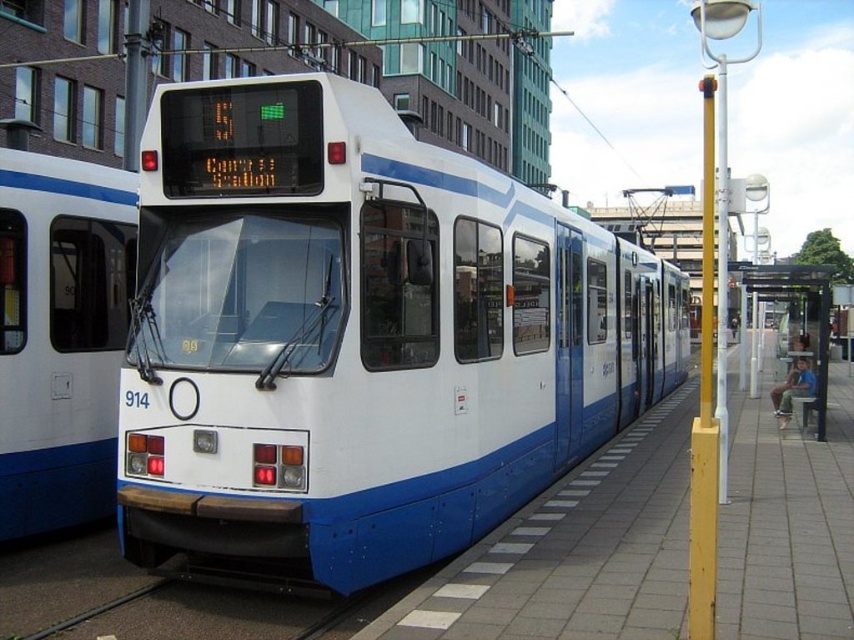
You are a delivery person carrying a large package that is 12 meters long. You need to move from the white glossy train at left to the transparent plastic bus stop at right. Is there enough space for your package to fit between them without bending it?

The distance between the white glossy train at left and transparent plastic bus stop at right is 11.89 meters, which is shorter than the 12 meter length of the package. Therefore, the package cannot fit straight between them without bending.

You are a passenger waiting at the tram station. You see two trams, the white glossy train at center and the white glossy train at left. Which tram is closer to the platform edge?

The white glossy train at left is closer to the platform edge because the white glossy train at center is positioned on the right side of it, meaning the left tram is nearer to the edge while the center tram is further inward.

You are a passenger waiting at the station. You see the white glossy train at center and the transparent plastic bus stop at right. Which one is shorter in height?

The white glossy train at center is not as tall as the transparent plastic bus stop at right, so the white glossy train at center is shorter in height.